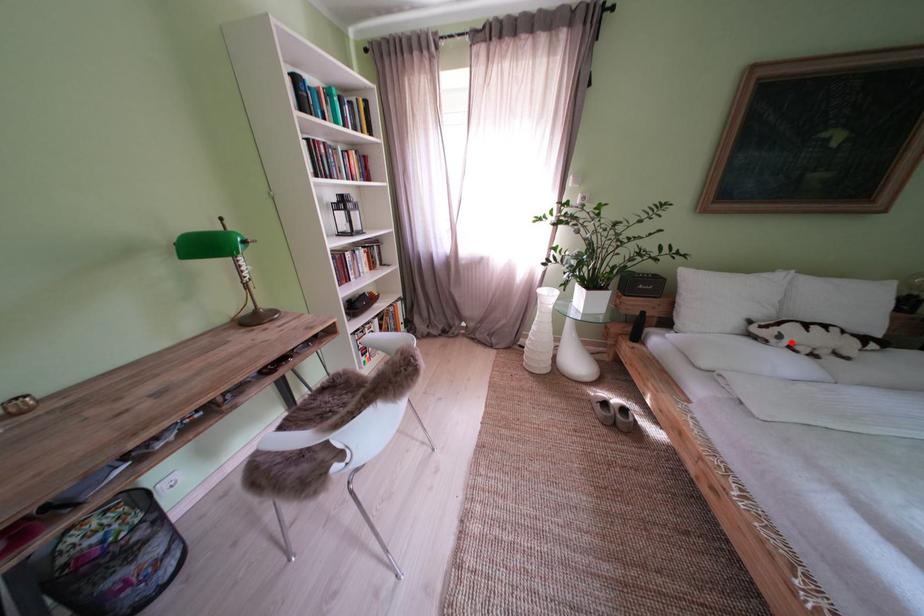
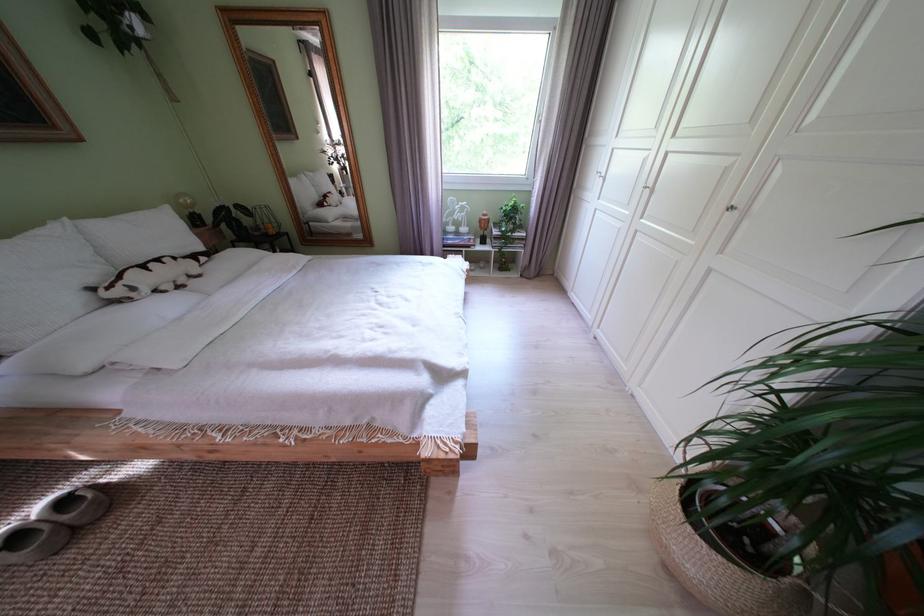
The point at the highlighted location is marked in the first image. Where is the corresponding point in the second image?

(146, 294)